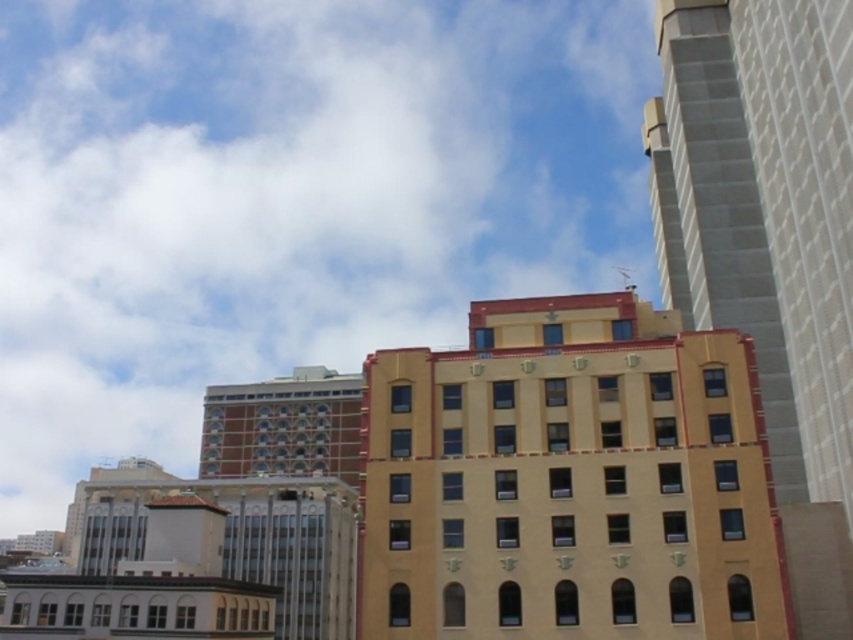
You are standing in the cityscape and want to determine which of the two points, point (730, 529) or point (788, 573), is closer to you. Based on the scene, which point is nearer?

Point (730, 529) is closer to you because it is further to the camera than point (788, 573).

You are standing at the origin point in the cityscape image. Which building is located at the coordinate point (569, 481)?

The yellow matte building at center is located at point (569, 481).

Looking at this image, you are standing in the city square and want to take a photo of the yellow matte building at center and the smooth concrete skyscraper at right. Which building should you position yourself to the left of to capture both in the frame?

You should position yourself to the left of the yellow matte building at center because it is located to the left of the smooth concrete skyscraper at right, so positioning yourself there will allow both buildings to be captured in the frame.